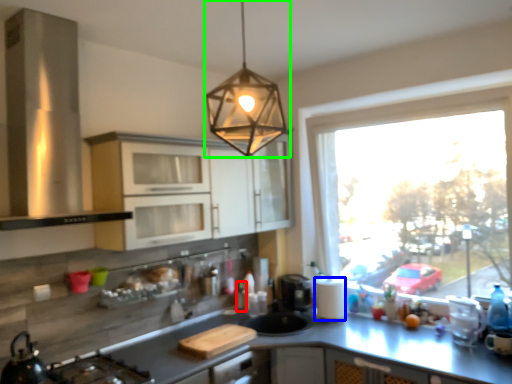
Question: Estimate the real-world distances between objects in this image. Which object is closer to bottle (highlighted by a red box), paper towel (highlighted by a blue box) or lamp (highlighted by a green box)?

Choices:
 (A) paper towel
 (B) lamp

Answer: (A)